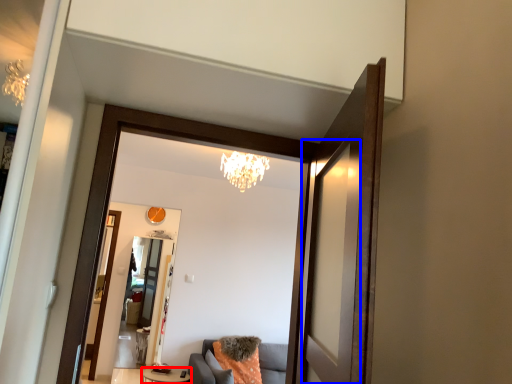
Question: Which object is further to the camera taking this photo, table (highlighted by a red box) or screen door (highlighted by a blue box)?

Choices:
 (A) table
 (B) screen door

Answer: (A)